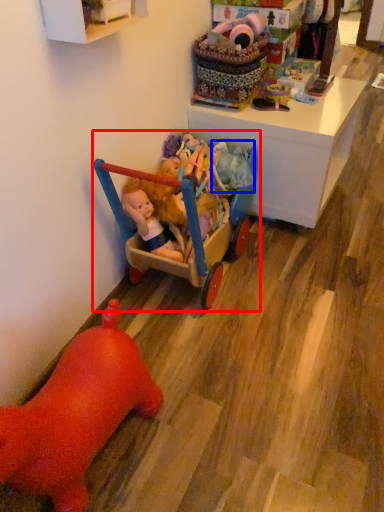
Question: Which object is further to the camera taking this photo, toy (highlighted by a red box) or toy (highlighted by a blue box)?

Choices:
 (A) toy
 (B) toy

Answer: (B)